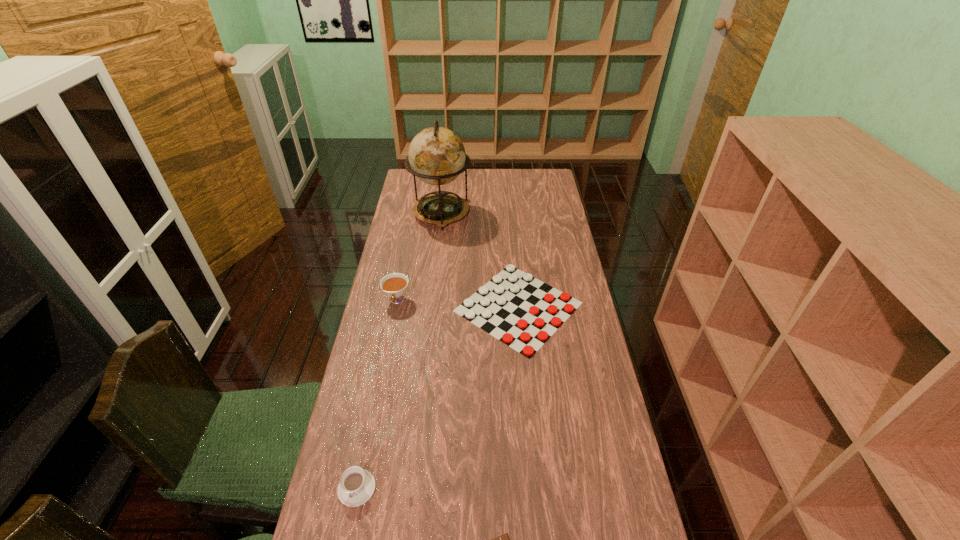
Identify the location of vacant space in between the nearer teacup and the farther teacup. [x=377, y=394].

Identify the location of blank region between the fourth shortest object and the fourth farthest object. (377, 394).

Image resolution: width=960 pixels, height=540 pixels. I want to click on blank region between the second tallest object and the fourth tallest object, so click(458, 303).

Locate an element on the screen. This screenshot has height=540, width=960. vacant space that is in between the tallest object and the checkerboard is located at coordinates (480, 260).

I want to click on object that stands as the closest to the farther teacup, so click(x=525, y=326).

What are the coordinates of `the closest object relative to the farther teacup` in the screenshot? It's located at (525, 326).

Where is `free space that satisfies the following two spatial constraints: 1. on the side of the farther teacup with the handle; 2. on the left side of the checkerboard`? This screenshot has width=960, height=540. free space that satisfies the following two spatial constraints: 1. on the side of the farther teacup with the handle; 2. on the left side of the checkerboard is located at coordinates (396, 307).

Find the location of a particular element. The width and height of the screenshot is (960, 540). vacant region that satisfies the following two spatial constraints: 1. on the side of the second tallest object with the handle; 2. on the right side of the second shortest object is located at coordinates (396, 307).

The image size is (960, 540). I want to click on vacant space that satisfies the following two spatial constraints: 1. on the side of the second shortest object with the handle; 2. on the right side of the taller teacup, so click(x=396, y=307).